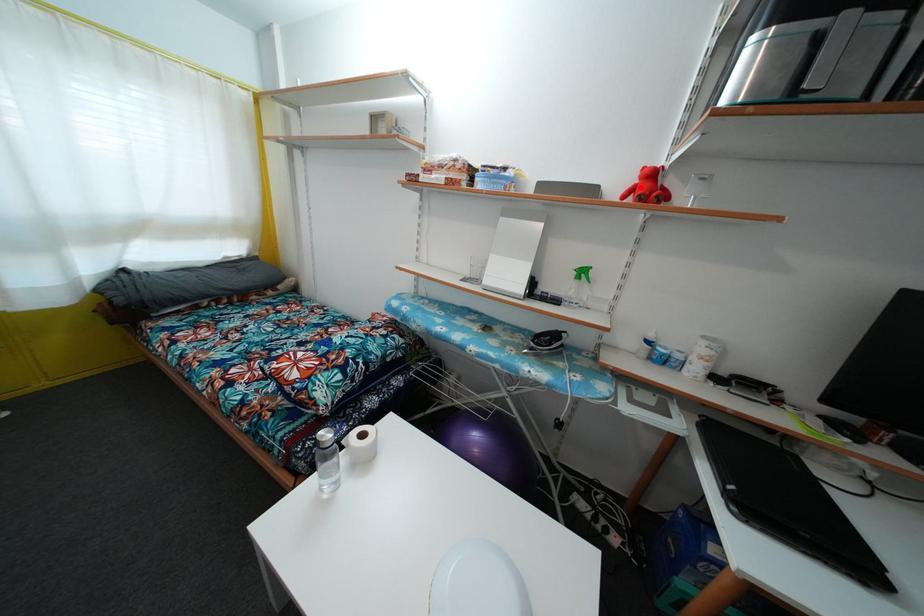
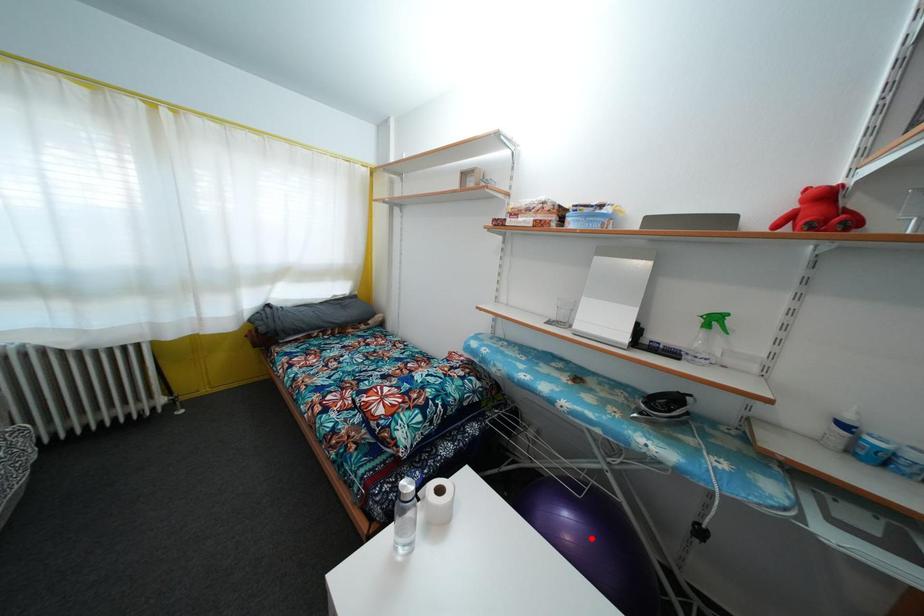
I am providing you with two images of the same scene from different viewpoints. A red point is marked on the first image and another point is marked on the second image. Is the marked point in image1 the same physical position as the marked point in image2?

No